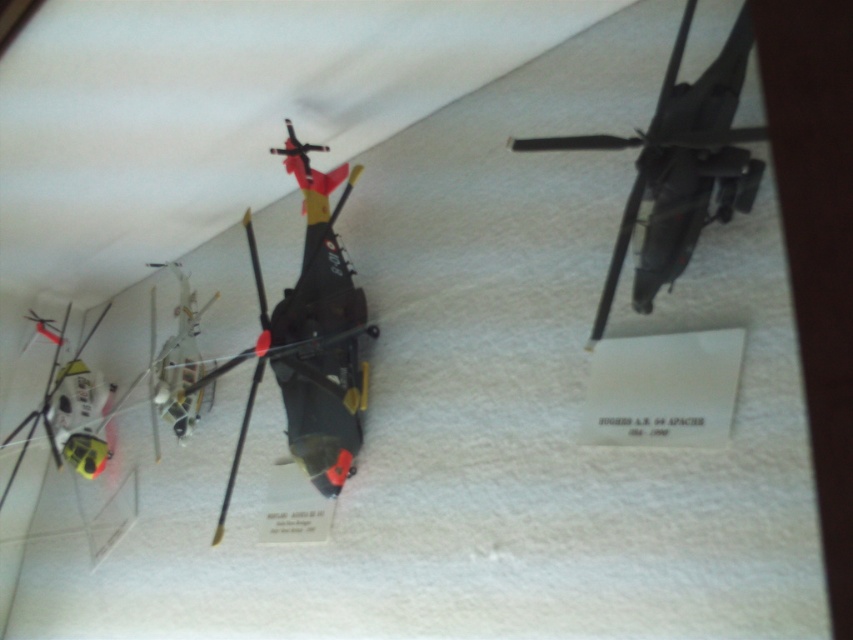
Which is in front, point (730, 205) or point (187, 396)?

Point (730, 205)

Is matte black helicopter at upper right further to camera compared to metallic silver helicopter at center?

No, matte black helicopter at upper right is closer to the viewer.

Is point (697, 144) closer to viewer compared to point (190, 298)?

Yes, point (697, 144) is in front of point (190, 298).

Identify the location of matte black helicopter at upper right. (677, 164).